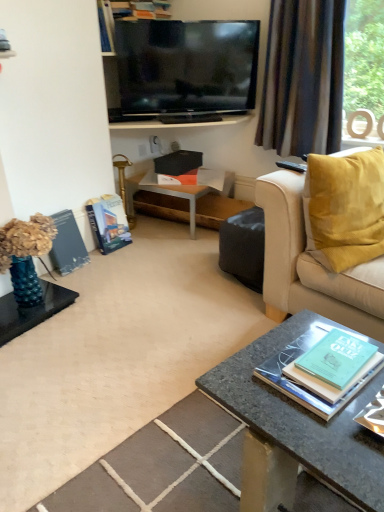
Question: From the image's perspective, is matte black magazine at left, which is the first magazine in left-to-right order, on top of smooth stone coffee table at center?

Choices:
 (A) no
 (B) yes

Answer: (B)

Question: Considering the relative sizes of matte black magazine at left, which ranks as the third magazine in right-to-left order, and smooth stone coffee table at center in the image provided, is matte black magazine at left, which ranks as the third magazine in right-to-left order, wider than smooth stone coffee table at center?

Choices:
 (A) yes
 (B) no

Answer: (B)

Question: Is matte black magazine at left, which ranks as the third magazine in right-to-left order, thinner than smooth stone coffee table at center?

Choices:
 (A) no
 (B) yes

Answer: (B)

Question: Can you confirm if matte black magazine at left, which ranks as the third magazine in right-to-left order, is smaller than smooth stone coffee table at center?

Choices:
 (A) no
 (B) yes

Answer: (B)

Question: From the image's perspective, is matte black magazine at left, which ranks as the third magazine in right-to-left order, beneath smooth stone coffee table at center?

Choices:
 (A) no
 (B) yes

Answer: (A)

Question: From a real-world perspective, is matte black magazine at left, which ranks as the third magazine in right-to-left order, located higher than smooth stone coffee table at center?

Choices:
 (A) no
 (B) yes

Answer: (B)

Question: Is there a large distance between hardcover book at left, the second magazine when ordered from right to left, and hardcover book at upper center, which ranks as the first book in left-to-right order?

Choices:
 (A) no
 (B) yes

Answer: (B)

Question: Does hardcover book at left, acting as the 2th magazine starting from the left, have a lesser width compared to hardcover book at upper center, which is the 2th book in bottom-to-top order?

Choices:
 (A) yes
 (B) no

Answer: (A)

Question: Could you tell me if hardcover book at left, acting as the 2th magazine starting from the left, is turned towards hardcover book at upper center, which is the 2th book in bottom-to-top order?

Choices:
 (A) yes
 (B) no

Answer: (B)

Question: From a real-world perspective, is hardcover book at left, the second magazine when ordered from right to left, on hardcover book at upper center, which is the 2th book in bottom-to-top order?

Choices:
 (A) yes
 (B) no

Answer: (B)

Question: Is hardcover book at left, the second magazine when ordered from right to left, looking in the opposite direction of hardcover book at upper center, arranged as the first book when viewed from the back?

Choices:
 (A) no
 (B) yes

Answer: (A)

Question: Considering the relative positions of hardcover book at left, acting as the 2th magazine starting from the left, and hardcover book at upper center, arranged as the 2th book when viewed from the front, in the image provided, is hardcover book at left, acting as the 2th magazine starting from the left, behind hardcover book at upper center, arranged as the 2th book when viewed from the front,?

Choices:
 (A) no
 (B) yes

Answer: (B)

Question: Is green matte book at lower right, which appears as the 1th book when ordered from the bottom, beside flat-screen tv at upper center?

Choices:
 (A) no
 (B) yes

Answer: (A)